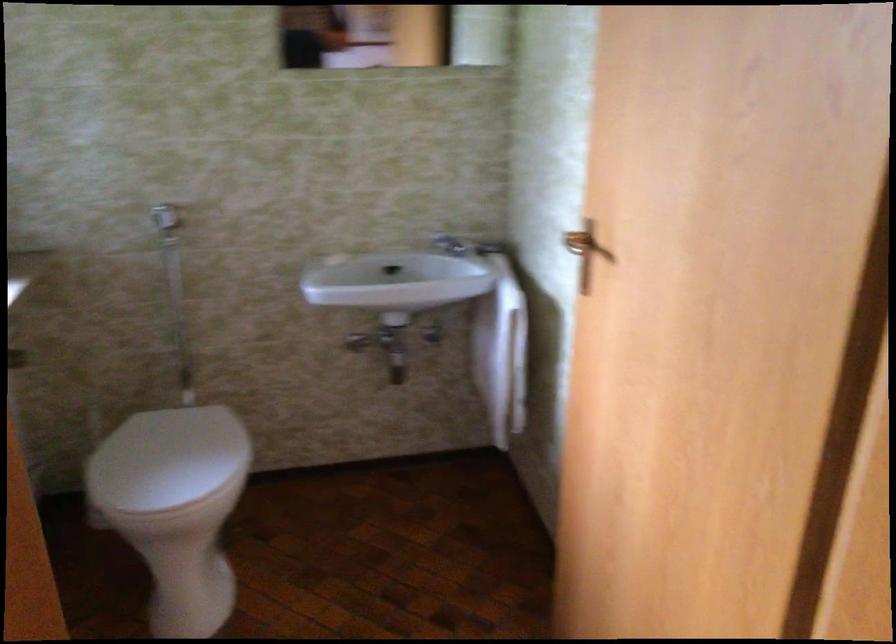
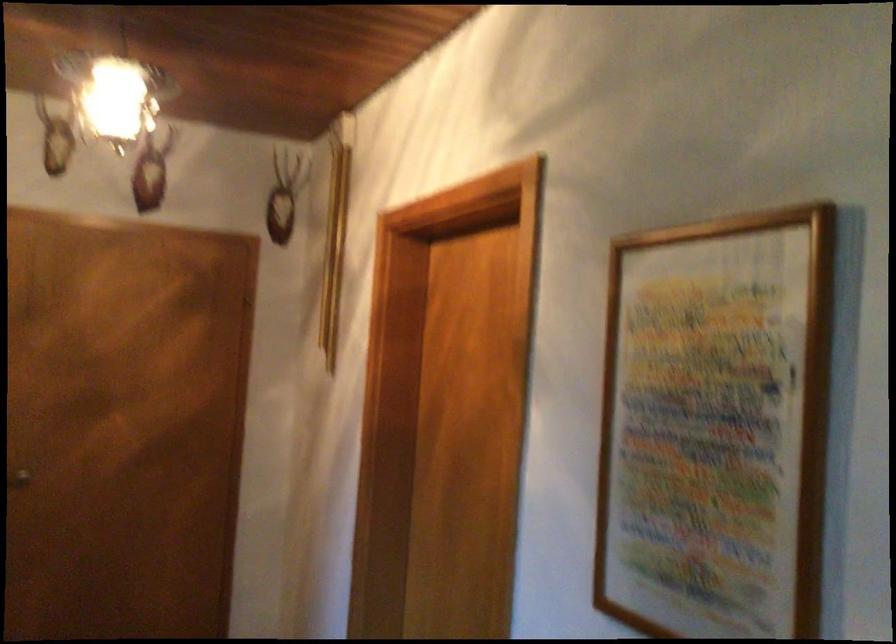
Question: The first image is from the beginning of the video and the second image is from the end. How did the camera likely rotate when shooting the video?

Choices:
 (A) Left
 (B) Right
 (C) Up
 (D) Down

Answer: (B)